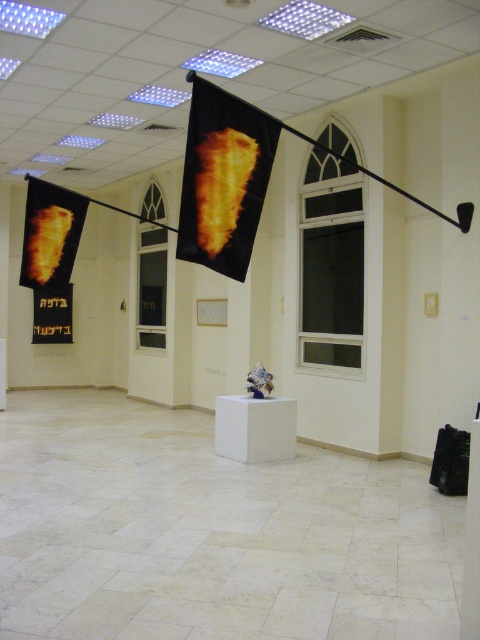
Question: Which object appears closest to the camera in this image?

Choices:
 (A) flame-patterned fabric banner at left
 (B) black matte flag at center

Answer: (B)

Question: Is black matte flag at center thinner than flame-patterned fabric banner at left?

Choices:
 (A) no
 (B) yes

Answer: (B)

Question: Observing the image, what is the correct spatial positioning of black matte flag at center in reference to flame-patterned fabric banner at left?

Choices:
 (A) right
 (B) left

Answer: (A)

Question: Is the position of black matte flag at center less distant than that of flame-patterned fabric banner at left?

Choices:
 (A) yes
 (B) no

Answer: (A)

Question: Which object appears farthest from the camera in this image?

Choices:
 (A) black matte flag at center
 (B) flame-patterned fabric banner at left

Answer: (B)